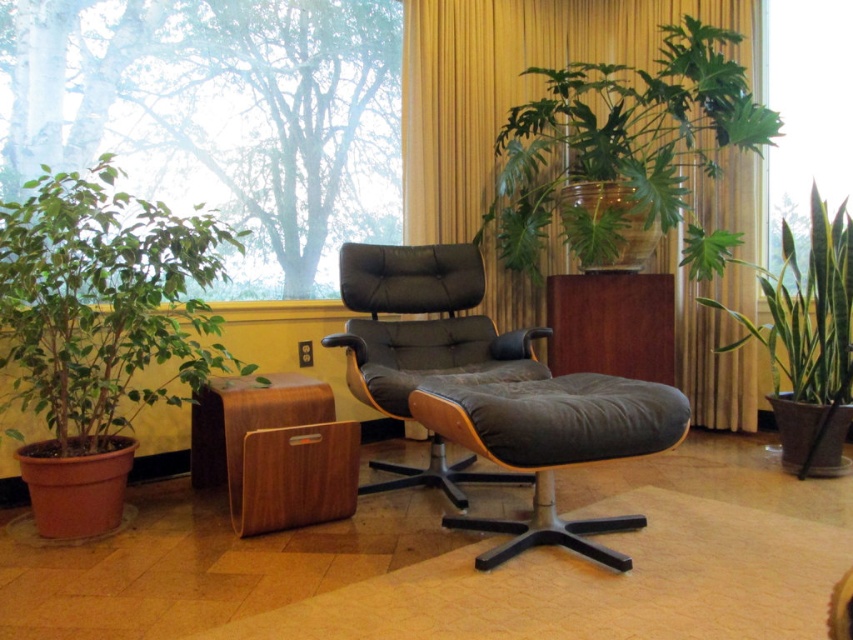
How much distance is there between green matte plant at left and green glossy plant at upper center?

green matte plant at left and green glossy plant at upper center are 5.89 feet apart from each other.

Who is more forward, (x=223, y=228) or (x=589, y=138)?

Point (x=589, y=138) is more forward.

Where is `green matte plant at left`? This screenshot has width=853, height=640. green matte plant at left is located at coordinates (103, 305).

Who is higher up, green matte plant at left or leather/black swivel chair at center?

green matte plant at left is above.

Between point (44, 355) and point (459, 362), which one is positioned in front?

Point (44, 355)

Where is `green matte plant at left`? Image resolution: width=853 pixels, height=640 pixels. green matte plant at left is located at coordinates click(103, 305).

Is green matte plant at left wider than suede/leather ottoman at center?

Yes.

Does point (76, 392) come closer to viewer compared to point (614, 406)?

No.

I want to click on green matte plant at left, so click(103, 305).